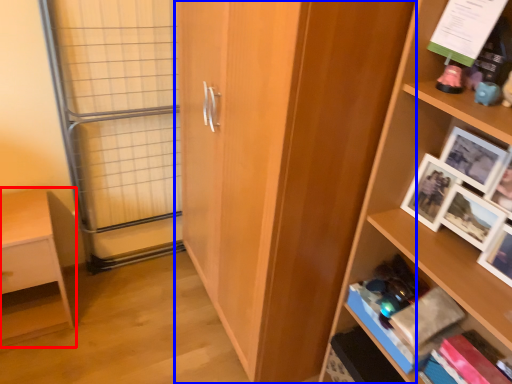
Question: Which object is further to the camera taking this photo, shelf (highlighted by a red box) or cupboard (highlighted by a blue box)?

Choices:
 (A) shelf
 (B) cupboard

Answer: (A)